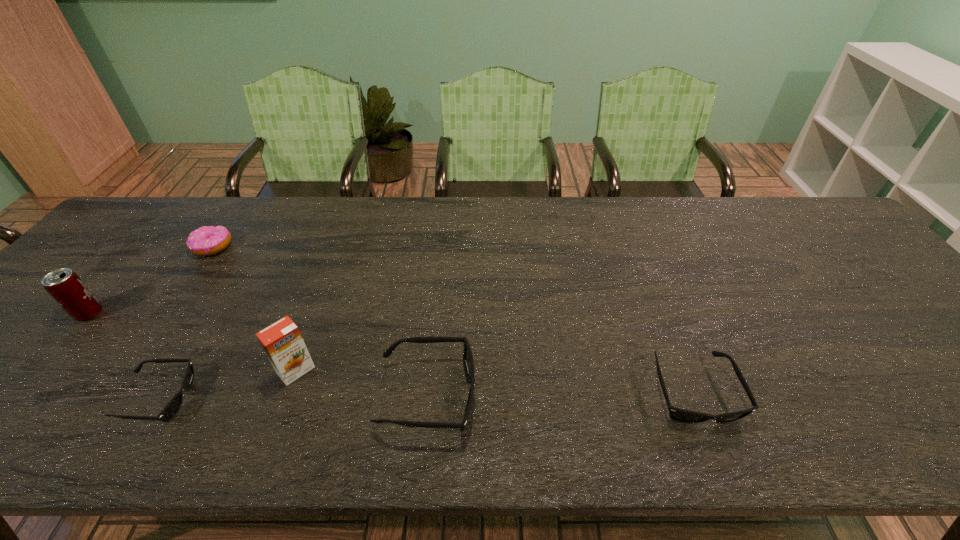
Considering the uniform spacing of sunglassess, where should an additional sunglasses be positioned on the right? Please locate a free spot. Please provide its 2D coordinates. Your answer should be formatted as a tuple, i.e. [(x, y)], where the tuple contains the x and y coordinates of a point satisfying the conditions above.

[(956, 389)]